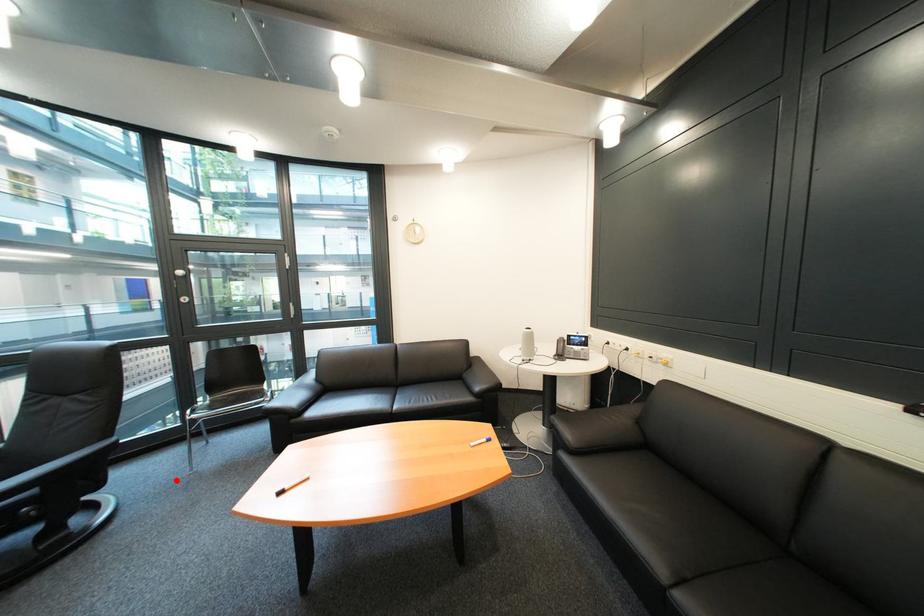
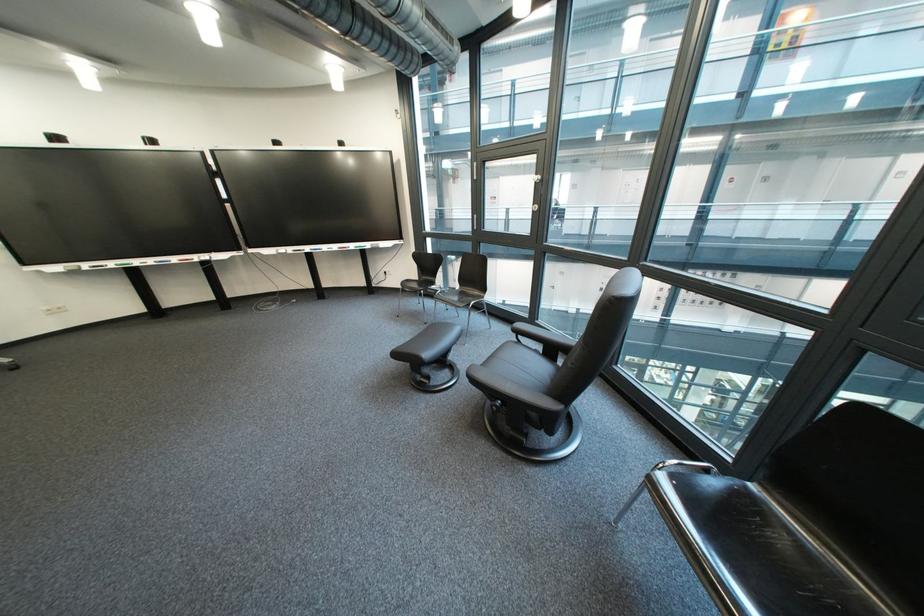
Where in the second image is the point corresponding to the highlighted location from the first image?

(622, 488)